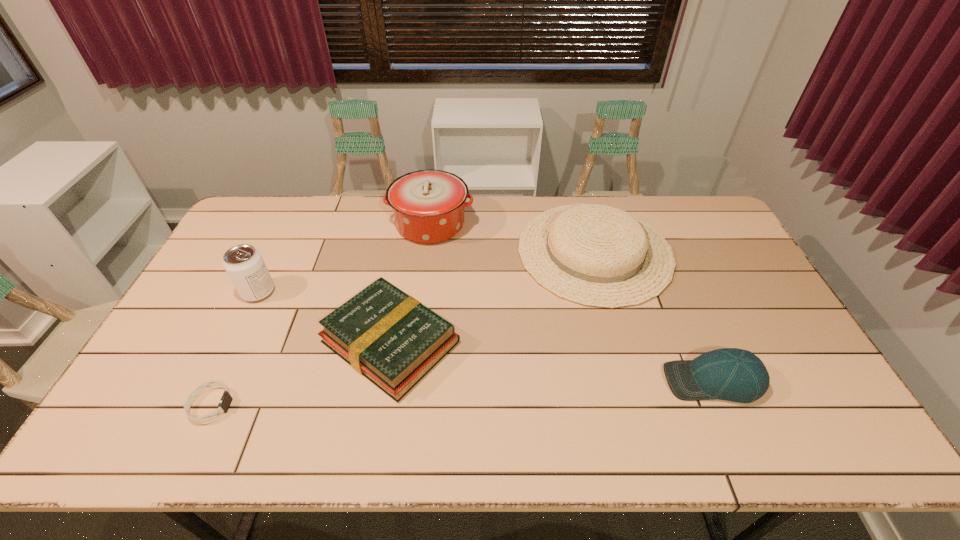
What are the coordinates of `casserole` in the screenshot? It's located at (428, 205).

Where is `soda can`? Image resolution: width=960 pixels, height=540 pixels. soda can is located at coordinates (243, 263).

The width and height of the screenshot is (960, 540). I want to click on sunhat, so click(595, 255).

At what (x,y) coordinates should I click in order to perform the action: click on baseball cap. Please return your answer as a coordinate pair (x, y). The height and width of the screenshot is (540, 960). Looking at the image, I should click on (731, 374).

What are the coordinates of `hardback book` in the screenshot? It's located at (392, 339).

Locate an element on the screen. Image resolution: width=960 pixels, height=540 pixels. wristband is located at coordinates (226, 399).

The image size is (960, 540). I want to click on free space located on the front of the casserole, so click(x=420, y=314).

This screenshot has height=540, width=960. In order to click on free space located on the back of the soda can in this screenshot , I will do `click(296, 214)`.

The image size is (960, 540). I want to click on free spot located 0.170m on the left of the sunhat, so click(x=468, y=252).

This screenshot has width=960, height=540. In order to click on free space located on the left of the baseball cap in this screenshot , I will do `click(574, 381)`.